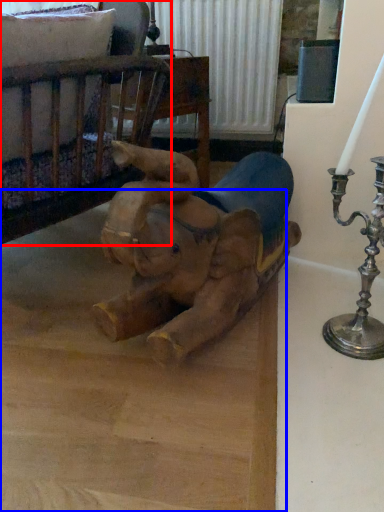
Question: Which object appears closest to the camera in this image, furniture (highlighted by a red box) or cardboard (highlighted by a blue box)?

Choices:
 (A) furniture
 (B) cardboard

Answer: (B)